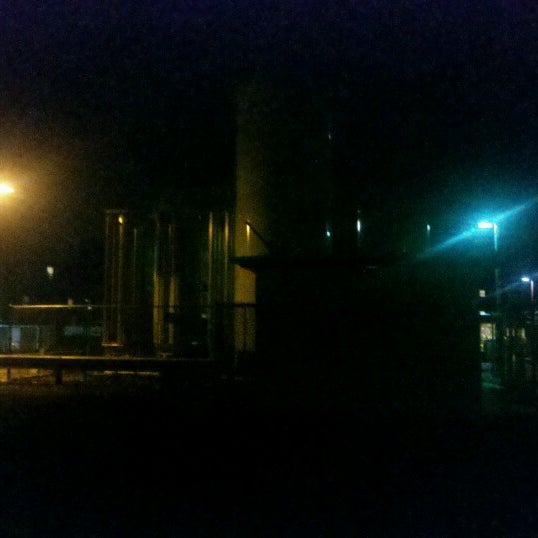
Image resolution: width=538 pixels, height=538 pixels. In order to click on yellow light in this screenshot , I will do `click(247, 231)`, `click(121, 220)`, `click(10, 188)`.